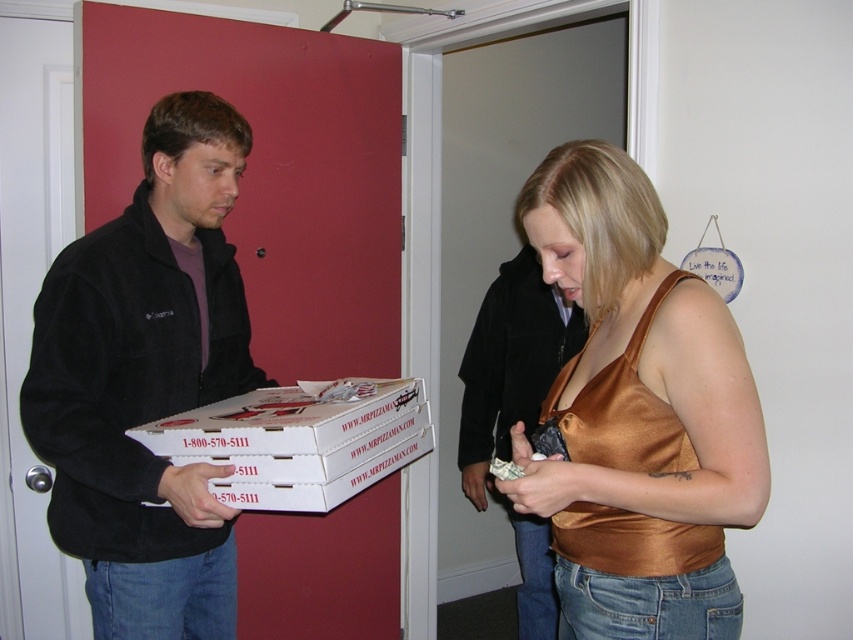
Who is positioned more to the left, gold satin tank top at center or black fleece jacket at left?

From the viewer's perspective, black fleece jacket at left appears more on the left side.

The height and width of the screenshot is (640, 853). What are the coordinates of `gold satin tank top at center` in the screenshot? It's located at (637, 416).

Identify the location of gold satin tank top at center. The width and height of the screenshot is (853, 640). (637, 416).

Identify the location of black fleece jacket at left. (148, 381).

Does black fleece jacket at left appear on the right side of white cardboard box at center?

Incorrect, black fleece jacket at left is not on the right side of white cardboard box at center.

Where is `black fleece jacket at left`? This screenshot has height=640, width=853. black fleece jacket at left is located at coordinates (148, 381).

Who is taller, gold satin tank top at center or white cardboard box at center?

gold satin tank top at center

Is point (677, 412) behind point (283, 509)?

No, (677, 412) is in front of (283, 509).

Between point (526, 211) and point (218, 484), which one is positioned behind?

Positioned behind is point (218, 484).

Identify the location of gold satin tank top at center. This screenshot has height=640, width=853. (637, 416).